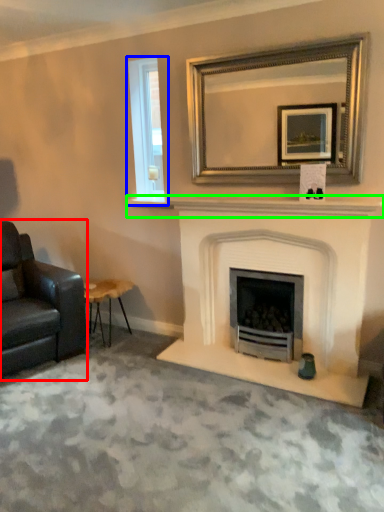
Question: Which is nearer to the chair (highlighted by a red box)? window (highlighted by a blue box) or mantle (highlighted by a green box).

Choices:
 (A) window
 (B) mantle

Answer: (B)